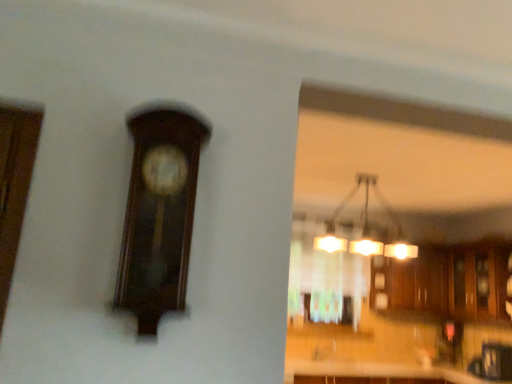
Question: Can you confirm if dark wood clock at upper left is positioned to the left of translucent glass window at center?

Choices:
 (A) yes
 (B) no

Answer: (A)

Question: From a real-world perspective, does dark wood clock at upper left stand above translucent glass window at center?

Choices:
 (A) no
 (B) yes

Answer: (A)

Question: Is the depth of dark wood clock at upper left greater than that of translucent glass window at center?

Choices:
 (A) no
 (B) yes

Answer: (A)

Question: From the image's perspective, would you say dark wood clock at upper left is shown under translucent glass window at center?

Choices:
 (A) no
 (B) yes

Answer: (A)

Question: From a real-world perspective, does dark wood clock at upper left sit lower than translucent glass window at center?

Choices:
 (A) yes
 (B) no

Answer: (A)

Question: Is dark wood clock at upper left far from translucent glass window at center?

Choices:
 (A) yes
 (B) no

Answer: (A)

Question: Does matte glass chandelier at upper center come behind translucent glass window at center?

Choices:
 (A) yes
 (B) no

Answer: (B)

Question: Does matte glass chandelier at upper center have a larger size compared to translucent glass window at center?

Choices:
 (A) no
 (B) yes

Answer: (A)

Question: Is matte glass chandelier at upper center thinner than translucent glass window at center?

Choices:
 (A) no
 (B) yes

Answer: (B)

Question: Is matte glass chandelier at upper center positioned far away from translucent glass window at center?

Choices:
 (A) yes
 (B) no

Answer: (B)

Question: Considering the relative sizes of matte glass chandelier at upper center and translucent glass window at center in the image provided, is matte glass chandelier at upper center shorter than translucent glass window at center?

Choices:
 (A) no
 (B) yes

Answer: (B)

Question: From the image's perspective, does matte glass chandelier at upper center appear higher than translucent glass window at center?

Choices:
 (A) no
 (B) yes

Answer: (B)

Question: Is wooden cabinets at center positioned with its back to dark wood clock at upper left?

Choices:
 (A) yes
 (B) no

Answer: (B)